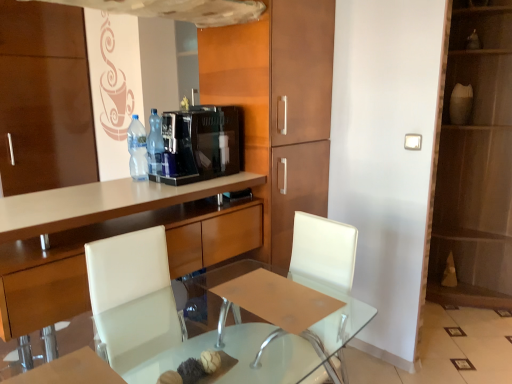
Question: In which direction should I rotate to look at translucent plastic bottle at center, positioned as the 2th bottle in left-to-right order?

Choices:
 (A) right
 (B) left

Answer: (B)

Question: From a real-world perspective, is clear plastic bottle at center, the 1th bottle in the left-to-right sequence, positioned over wooden cabinet at center, the 2th cabinetry when ordered from left to right, based on gravity?

Choices:
 (A) yes
 (B) no

Answer: (A)

Question: Is clear plastic bottle at center, the 1th bottle in the left-to-right sequence, positioned before wooden cabinet at center, the 2th cabinetry when ordered from left to right?

Choices:
 (A) yes
 (B) no

Answer: (B)

Question: Could you tell me if clear plastic bottle at center, the 1th bottle in the left-to-right sequence, is turned towards wooden cabinet at center, the 2th cabinetry when ordered from left to right?

Choices:
 (A) no
 (B) yes

Answer: (A)

Question: Can we say clear plastic bottle at center, the 1th bottle in the left-to-right sequence, lies outside wooden cabinet at center, which ranks as the 1th cabinetry in right-to-left order?

Choices:
 (A) yes
 (B) no

Answer: (A)

Question: Does clear plastic bottle at center, the 1th bottle in the left-to-right sequence, have a larger size compared to wooden cabinet at center, which ranks as the 1th cabinetry in right-to-left order?

Choices:
 (A) no
 (B) yes

Answer: (A)

Question: Is clear plastic bottle at center, the 1th bottle in the left-to-right sequence, smaller than wooden cabinet at center, which ranks as the 1th cabinetry in right-to-left order?

Choices:
 (A) yes
 (B) no

Answer: (A)

Question: Is wooden cabinet at center, the 2th cabinetry when ordered from left to right, aimed at matte brown dresser at right?

Choices:
 (A) no
 (B) yes

Answer: (A)

Question: Is wooden cabinet at center, which ranks as the 1th cabinetry in right-to-left order, positioned behind matte brown dresser at right?

Choices:
 (A) yes
 (B) no

Answer: (B)

Question: From the image's perspective, is wooden cabinet at center, which ranks as the 1th cabinetry in right-to-left order, under matte brown dresser at right?

Choices:
 (A) no
 (B) yes

Answer: (B)

Question: Is wooden cabinet at center, which ranks as the 1th cabinetry in right-to-left order, oriented away from matte brown dresser at right?

Choices:
 (A) no
 (B) yes

Answer: (A)

Question: From the image's perspective, is wooden cabinet at center, which ranks as the 1th cabinetry in right-to-left order, located above matte brown dresser at right?

Choices:
 (A) yes
 (B) no

Answer: (B)

Question: Is wooden cabinet at center, which ranks as the 1th cabinetry in right-to-left order, at the left side of matte brown dresser at right?

Choices:
 (A) no
 (B) yes

Answer: (B)

Question: Could you tell me if clear glass table at center is turned towards black glossy coffee machine at center?

Choices:
 (A) yes
 (B) no

Answer: (B)